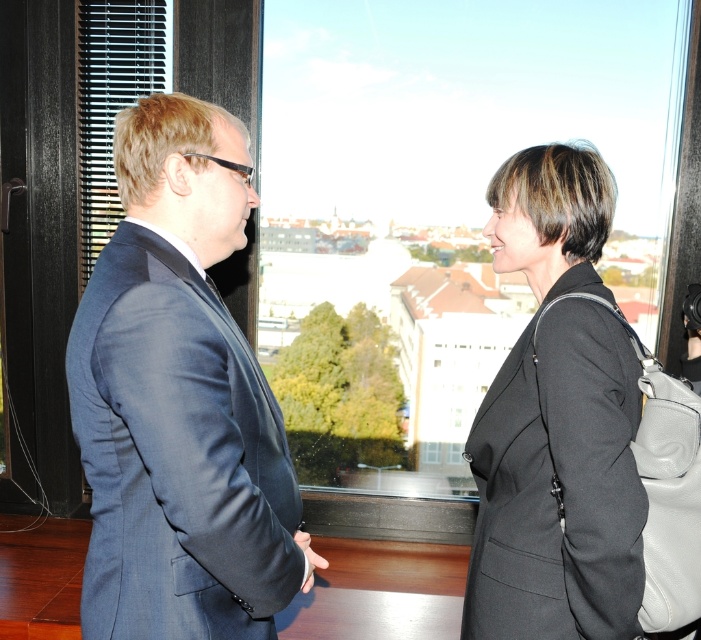
Is point (114, 280) positioned behind point (522, 508)?

That is False.

Which of these two, dark blue suit at left or matte black coat at right, stands shorter?

matte black coat at right is shorter.

Between point (95, 600) and point (566, 244), which one is positioned in front?

Positioned in front is point (95, 600).

Image resolution: width=701 pixels, height=640 pixels. What are the coordinates of `dark blue suit at left` in the screenshot? It's located at (179, 400).